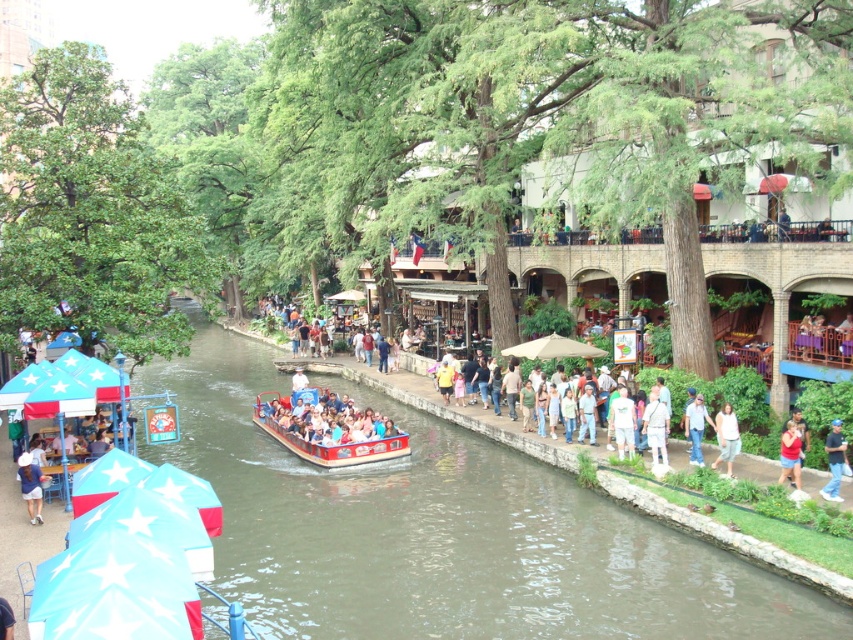
You are standing at the riverbank and want to take a photo of both the red and blue tour boat and the promenade with the trees. You have two points marked on your camera screen, point A at coordinates point (630, 413) and point B at coordinates point (720, 440). Which point should you focus on to ensure both the boat and the promenade are in clear focus?

Point A at coordinates point (630, 413) is further to the camera than point B at coordinates point (720, 440). To ensure both the boat and the promenade are in clear focus, focus on point A since it is closer to the camera, allowing the depth of field to cover the distance to the promenade behind.

You are a photographer standing at the riverbank and want to capture both the blue denim jeans at lower right and the red cotton shirt at lower right in a single frame. Which object should you focus on first to ensure both are in the frame?

The blue denim jeans at lower right is larger in size compared to the red cotton shirt at lower right, so focusing on the blue denim jeans at lower right first will help ensure both objects are included in the frame.

You are a photographer standing at the riverbank and want to capture both the blue denim jeans at lower right and the red cotton shirt at lower right in a single photo. Which object should you focus on to ensure both are in frame without moving the camera?

You should focus on the blue denim jeans at lower right because it might be wider than the red cotton shirt at lower right, so centering on the wider object increases the likelihood of both being in the frame.